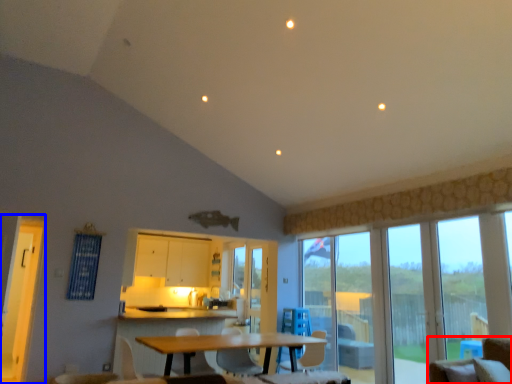
Question: Which of the following is the farthest to the observer, chair (highlighted by a red box) or screen door (highlighted by a blue box)?

Choices:
 (A) chair
 (B) screen door

Answer: (B)